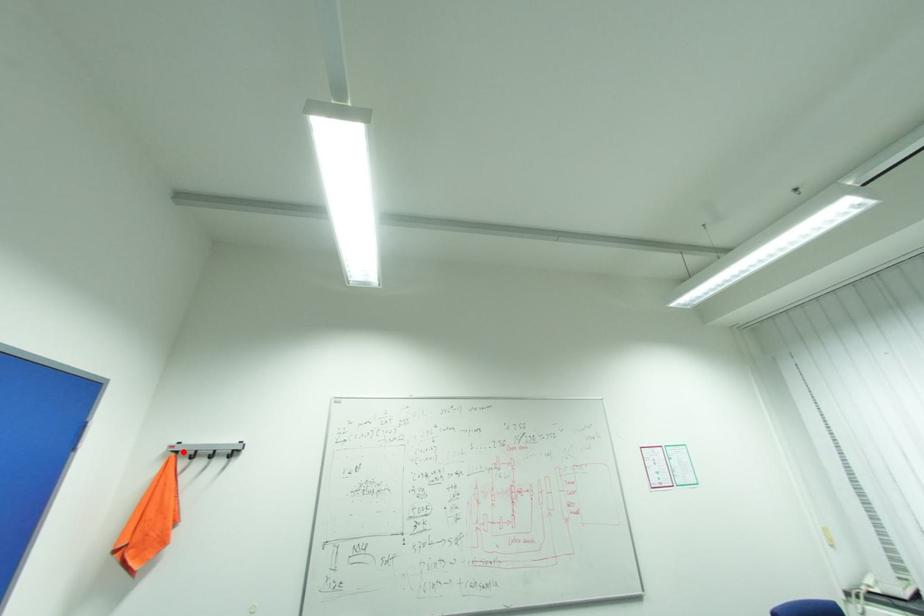
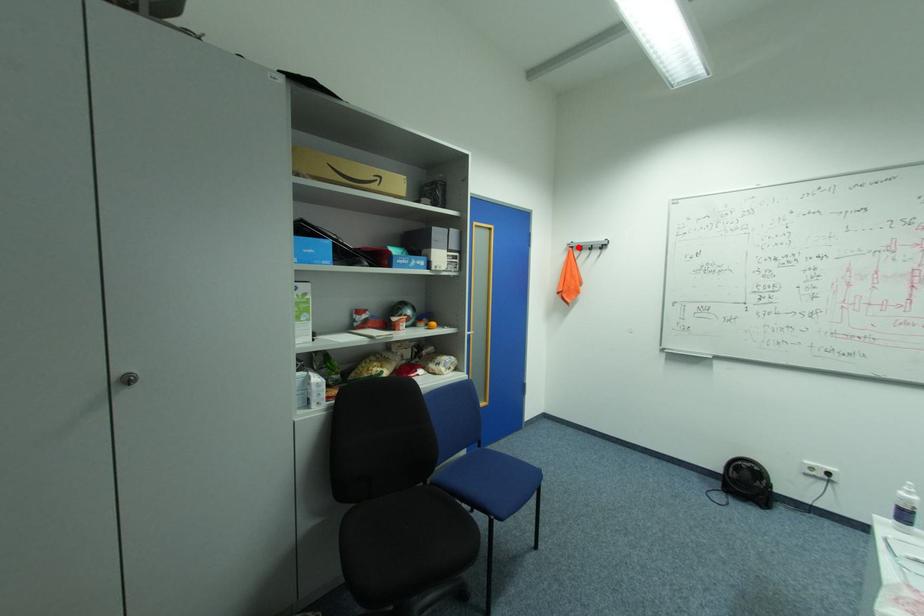
I am providing you with two images of the same scene from different viewpoints. A red point is marked on the first image and another point is marked on the second image. Does the point marked in image1 correspond to the same location as the one in image2?

Yes